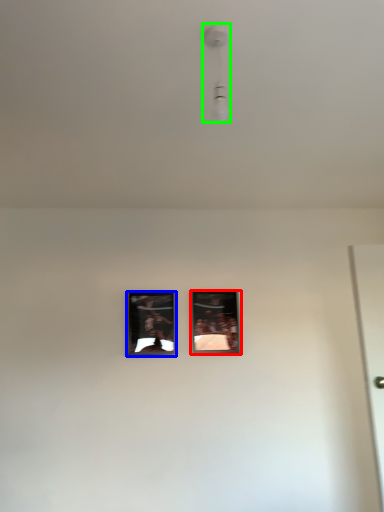
Question: Based on their relative distances, which object is nearer to picture frame (highlighted by a red box)? Choose from picture frame (highlighted by a blue box) and light fixture (highlighted by a green box).

Choices:
 (A) picture frame
 (B) light fixture

Answer: (A)